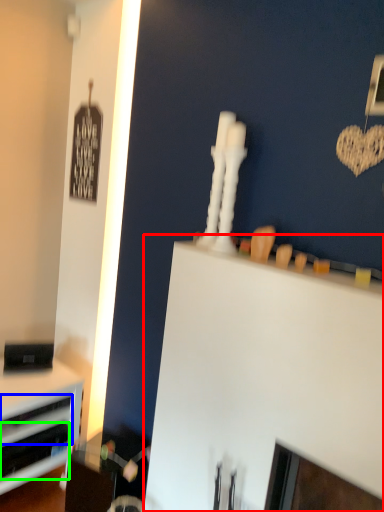
Question: Based on their relative distances, which object is nearer to computer desk (highlighted by a red box)? Choose from drawer (highlighted by a blue box) and drawer (highlighted by a green box).

Choices:
 (A) drawer
 (B) drawer

Answer: (A)